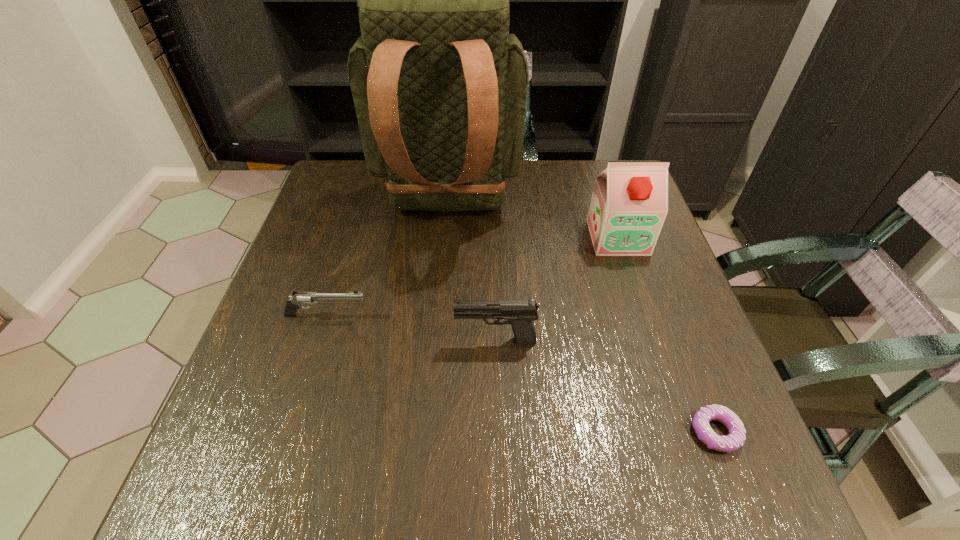
Image resolution: width=960 pixels, height=540 pixels. In order to click on free region located aim along the barrel of the third tallest object in this screenshot , I will do tap(392, 340).

Locate an element on the screen. blank space located 0.340m aim along the barrel of the third tallest object is located at coordinates (287, 340).

You are a GUI agent. You are given a task and a screenshot of the screen. Output one action in this format:
    pyautogui.click(x=<x>, y=<y>)
    Task: Click on the vacant area located aim along the barrel of the third tallest object
    
    Given the screenshot: What is the action you would take?
    pyautogui.click(x=406, y=340)

Find the location of a particular element. vacant space located on the front-facing side of the third nearest object is located at coordinates (520, 315).

Find the location of `blank space located on the back of the shortest object`. blank space located on the back of the shortest object is located at coordinates (654, 274).

Image resolution: width=960 pixels, height=540 pixels. Identify the location of object at the far edge. (439, 85).

In order to click on object located at the near edge in this screenshot , I will do `click(736, 438)`.

In order to click on object located in the left edge section of the desktop in this screenshot , I will do `click(299, 298)`.

You are a GUI agent. You are given a task and a screenshot of the screen. Output one action in this format:
    pyautogui.click(x=<x>, y=<y>)
    Task: Click on the soya milk that is positioned at the right edge
    
    Given the screenshot: What is the action you would take?
    pyautogui.click(x=629, y=204)

At what (x,y) coordinates should I click in order to perform the action: click on doughnut that is at the right edge. Please return your answer as a coordinate pair (x, y). This screenshot has height=540, width=960. Looking at the image, I should click on (736, 438).